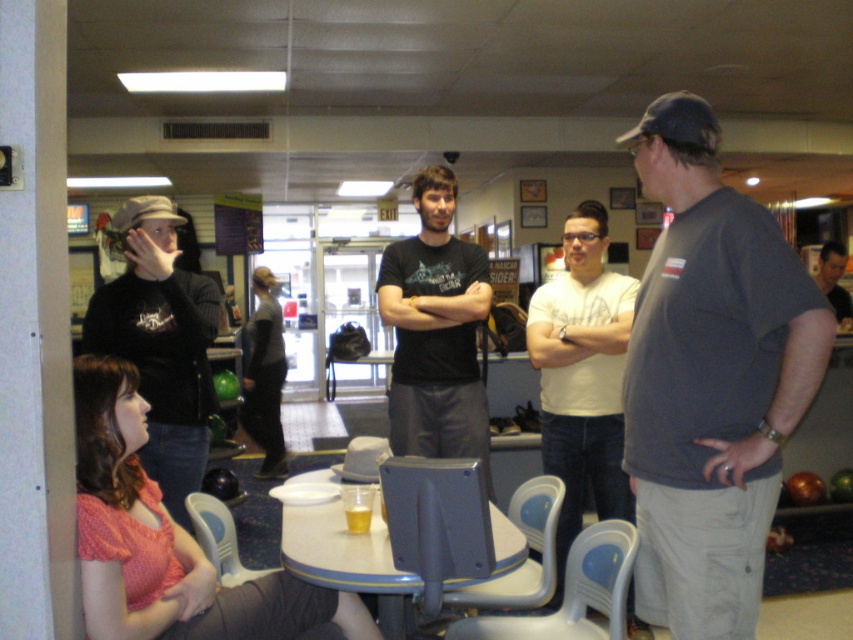
Is matte black shirt at left positioned before matte black shirt at center?

Yes.

I want to click on matte black shirt at left, so click(x=161, y=342).

This screenshot has height=640, width=853. Describe the element at coordinates (161, 342) in the screenshot. I see `matte black shirt at left` at that location.

Where is `matte black shirt at left`? This screenshot has height=640, width=853. matte black shirt at left is located at coordinates (161, 342).

Does dark gray sweater at center come in front of gray fabric chair at center?

No, it is not.

Image resolution: width=853 pixels, height=640 pixels. I want to click on dark gray sweater at center, so click(x=264, y=374).

Is point (267, 412) positioned after point (347, 460)?

Yes, it is.

Find the location of a particular element. This screenshot has height=640, width=853. dark gray sweater at center is located at coordinates (264, 374).

Between point (155, 204) and point (213, 557), which one is positioned behind?

Positioned behind is point (155, 204).

Is point (113, 324) closer to viewer compared to point (207, 499)?

Yes.

Where is `matte black shirt at left`? matte black shirt at left is located at coordinates (161, 342).